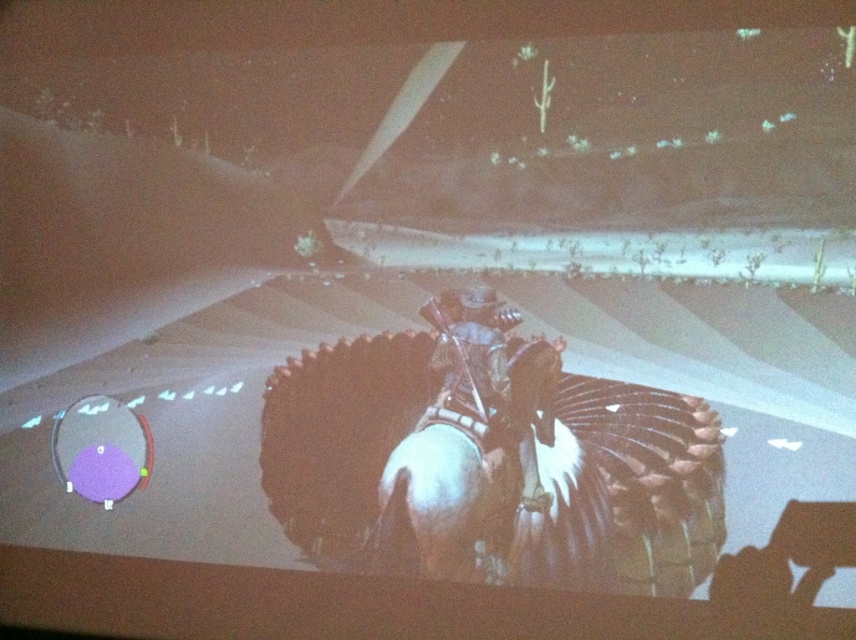
Does white matte horse at center have a greater width compared to metallic armor at center?

Yes.

Which is in front, point (495, 474) or point (461, 401)?

Point (495, 474) is in front.

What do you see at coordinates (465, 467) in the screenshot? I see `white matte horse at center` at bounding box center [465, 467].

You are a GUI agent. You are given a task and a screenshot of the screen. Output one action in this format:
    pyautogui.click(x=<x>, y=<y>)
    Task: Click on the white matte horse at center
    Image resolution: width=856 pixels, height=640 pixels.
    Given the screenshot: What is the action you would take?
    pyautogui.click(x=465, y=467)